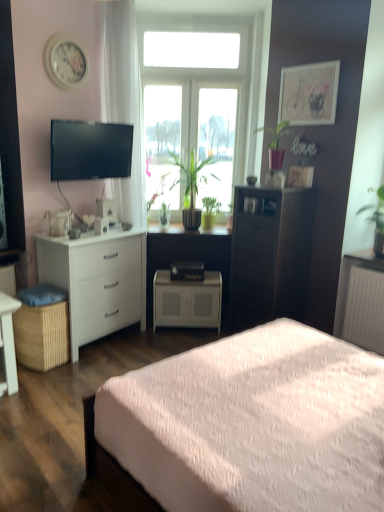
What do you see at coordinates (270, 256) in the screenshot?
I see `dark wood cabinet at center, the 1th chest of drawers in the right-to-left sequence` at bounding box center [270, 256].

The image size is (384, 512). Describe the element at coordinates (365, 309) in the screenshot. I see `white metallic radiator at lower right` at that location.

Describe the element at coordinates (42, 335) in the screenshot. I see `brown woven picnic basket at lower left` at that location.

How much space does white matte cabinet at center, positioned as the second chest of drawers in left-to-right order, occupy vertically?

white matte cabinet at center, positioned as the second chest of drawers in left-to-right order, is 50.84 centimeters tall.

Measure the distance between purple matte plant at upper right, which is the 2th houseplant from right to left, and camera.

purple matte plant at upper right, which is the 2th houseplant from right to left, is 3.59 meters away from camera.

At what (x,y) coordinates should I click in order to perform the action: click on purple matte plant at upper right, which is the 2th houseplant from right to left. Please return your answer as a coordinate pair (x, y). The height and width of the screenshot is (512, 384). Looking at the image, I should click on (276, 145).

The image size is (384, 512). In order to click on dark wood cabinet at center, the 1th chest of drawers in the right-to-left sequence in this screenshot , I will do `click(270, 256)`.

Between point (39, 306) and point (242, 396), which one is positioned in front?

The point (242, 396) is closer to the camera.

Would you consider brown woven picnic basket at lower left to be distant from white quilted bed at center?

Yes, brown woven picnic basket at lower left and white quilted bed at center are located far from each other.

Which of these two, brown woven picnic basket at lower left or white quilted bed at center, is bigger?

Bigger between the two is white quilted bed at center.

How far apart are brown woven picnic basket at lower left and white quilted bed at center?

They are 4.99 feet apart.

Is white glossy clock at upper left to the left or to the right of white matte cabinet at center, which appears as the 2th chest of drawers when viewed from the right, in the image?

white glossy clock at upper left is positioned on white matte cabinet at center, which appears as the 2th chest of drawers when viewed from the right,'s left side.

Who is shorter, white glossy clock at upper left or white matte cabinet at center, positioned as the second chest of drawers in left-to-right order?

With less height is white glossy clock at upper left.

How distant is white glossy clock at upper left from white matte cabinet at center, positioned as the second chest of drawers in left-to-right order?

white glossy clock at upper left and white matte cabinet at center, positioned as the second chest of drawers in left-to-right order, are 1.98 meters apart from each other.

Is white glossy clock at upper left touching white matte cabinet at center, which appears as the 2th chest of drawers when viewed from the right?

No.

From a real-world perspective, between white sheer curtain at upper left and dark wood cabinet at center, the 3th chest of drawers when ordered from left to right, who is vertically higher?

From a 3D spatial view, white sheer curtain at upper left is above.

Looking at their sizes, would you say white sheer curtain at upper left is wider or thinner than dark wood cabinet at center, the 3th chest of drawers when ordered from left to right?

In the image, white sheer curtain at upper left appears to be more narrow than dark wood cabinet at center, the 3th chest of drawers when ordered from left to right.

Is white sheer curtain at upper left positioned with its back to dark wood cabinet at center, the 3th chest of drawers when ordered from left to right?

That's not correct — white sheer curtain at upper left is not looking away from dark wood cabinet at center, the 3th chest of drawers when ordered from left to right.

Is point (127, 111) less distant than point (242, 283)?

No, it is behind (242, 283).

Which point is more forward, (154, 183) or (189, 181)?

Result: The point (189, 181) is closer.

From a real-world perspective, which houseplant is the 1st one underneath the green matte plant at center, marked as the second houseplant in a left-to-right arrangement? Please provide its 2D coordinates.

[(164, 196)]

Based on the photo, from a real-world perspective, who is located lower, green matte plant at center, placed as the fifth houseplant when sorted from right to left, or green matte plant at center, which appears as the fourth houseplant when viewed from the right?

From a 3D spatial view, green matte plant at center, placed as the fifth houseplant when sorted from right to left, is below.

Considering the relative positions of green matte plant at center, placed as the fifth houseplant when sorted from right to left, and green matte plant at center, marked as the second houseplant in a left-to-right arrangement, in the image provided, is green matte plant at center, placed as the fifth houseplant when sorted from right to left, to the left or to the right of green matte plant at center, marked as the second houseplant in a left-to-right arrangement,?

green matte plant at center, placed as the fifth houseplant when sorted from right to left, is to the left of green matte plant at center, marked as the second houseplant in a left-to-right arrangement.

From the image's perspective, which object appears higher, white metallic radiator at lower right or green matte plant at center, arranged as the third houseplant when viewed from the left?

green matte plant at center, arranged as the third houseplant when viewed from the left, appears higher in the image.

Consider the image. From a real-world perspective, is white metallic radiator at lower right above or below green matte plant at center, arranged as the third houseplant when viewed from the left?

In terms of real-world spatial position, white metallic radiator at lower right is below green matte plant at center, arranged as the third houseplant when viewed from the left.

Is green matte plant at center, arranged as the third houseplant when viewed from the left, located within white metallic radiator at lower right?

No, white metallic radiator at lower right does not contain green matte plant at center, arranged as the third houseplant when viewed from the left.

Is white metallic radiator at lower right not close to green matte plant at center, acting as the 3th houseplant starting from the right?

Yes.

Is there a large distance between green glossy plant at upper right, the fifth houseplant viewed from the left, and white matte cabinet at center?

Yes, green glossy plant at upper right, the fifth houseplant viewed from the left, and white matte cabinet at center are quite far apart.

From the image's perspective, is green glossy plant at upper right, the fifth houseplant viewed from the left, on white matte cabinet at center?

Yes.

Who is taller, green glossy plant at upper right, acting as the 1th houseplant starting from the right, or white matte cabinet at center?

With more height is white matte cabinet at center.

Is green glossy plant at upper right, acting as the 1th houseplant starting from the right, facing away from white matte cabinet at center?

green glossy plant at upper right, acting as the 1th houseplant starting from the right, does not have its back to white matte cabinet at center.

Find the location of a particular element. houseplant that is the 3rd object directly below the purple matte plant at upper right, which is the 2th houseplant from right to left (from a real-world perspective) is located at coordinates (376, 219).

Does green glossy plant at upper right, acting as the 1th houseplant starting from the right, touch purple matte plant at upper right, the 4th houseplant viewed from the left?

green glossy plant at upper right, acting as the 1th houseplant starting from the right, is not next to purple matte plant at upper right, the 4th houseplant viewed from the left, and they're not touching.

In terms of size, does green glossy plant at upper right, the fifth houseplant viewed from the left, appear bigger or smaller than purple matte plant at upper right, the 4th houseplant viewed from the left?

Considering their sizes, green glossy plant at upper right, the fifth houseplant viewed from the left, takes up more space than purple matte plant at upper right, the 4th houseplant viewed from the left.

Locate an element on the screen. This screenshot has width=384, height=512. bed in front of the brown woven picnic basket at lower left is located at coordinates (252, 424).

The image size is (384, 512). What are the coordinates of `the chest of drawers that is the 3rd one below the white glossy clock at upper left (from a real-world perspective)` in the screenshot? It's located at (187, 301).

Looking at the image, which one is located further to brown woven picnic basket at lower left, purple matte plant at upper right, which is the 2th houseplant from right to left, or white matte cabinet at center?

purple matte plant at upper right, which is the 2th houseplant from right to left, lies further to brown woven picnic basket at lower left than the other object.

Based on the photo, considering their positions, is white metallic radiator at lower right positioned closer to green glossy plant at upper right, the fifth houseplant viewed from the left, than green matte plant at center, which appears as the fourth houseplant when viewed from the right?

Among the two, white metallic radiator at lower right is located nearer to green glossy plant at upper right, the fifth houseplant viewed from the left.

Estimate the real-world distances between objects in this image. Which object is closer to white metallic radiator at lower right, white glossy coffee cup at left or white matte cabinet at center, which appears as the 2th chest of drawers when viewed from the right?

white matte cabinet at center, which appears as the 2th chest of drawers when viewed from the right.

Which object lies nearer to the anchor point matte white picture frame at upper right, white glossy desk at lower left or purple matte plant at upper right, which is the 2th houseplant from right to left?

Based on the image, purple matte plant at upper right, which is the 2th houseplant from right to left, appears to be nearer to matte white picture frame at upper right.

When comparing their distances from purple matte plant at upper right, the 4th houseplant viewed from the left, does white sheer curtain at upper left or white matte cabinet at center seem closer?

Based on the image, white matte cabinet at center appears to be nearer to purple matte plant at upper right, the 4th houseplant viewed from the left.

When comparing their distances from green matte plant at center, which appears as the fourth houseplant when viewed from the right, does purple matte plant at upper right, the 4th houseplant viewed from the left, or green matte plant at center, placed as the fifth houseplant when sorted from right to left, seem further?

The object further to green matte plant at center, which appears as the fourth houseplant when viewed from the right, is purple matte plant at upper right, the 4th houseplant viewed from the left.

From the picture: When comparing their distances from dark wood cabinet at center, the 3th chest of drawers when ordered from left to right, does white glossy coffee cup at left or white quilted bed at center seem closer?

white quilted bed at center lies closer to dark wood cabinet at center, the 3th chest of drawers when ordered from left to right, than the other object.

Based on their spatial positions, is green matte plant at center, the first houseplant in the left-to-right sequence, or transparent glass window at center closer to white quilted bed at center?

green matte plant at center, the first houseplant in the left-to-right sequence, is positioned closer to the anchor white quilted bed at center.

Locate an element on the screen. This screenshot has width=384, height=512. television between white glossy desk at lower left and purple matte plant at upper right, which is the 2th houseplant from right to left is located at coordinates (90, 150).

Find the location of `desk between white quilted bed at center and dark wood cabinet at center, the 3th chest of drawers when ordered from left to right, along the z-axis`. desk between white quilted bed at center and dark wood cabinet at center, the 3th chest of drawers when ordered from left to right, along the z-axis is located at coordinates (8, 343).

Locate an element on the screen. The width and height of the screenshot is (384, 512). coffee cup that lies between transparent glass window at center and brown woven picnic basket at lower left from top to bottom is located at coordinates (101, 225).

Identify the location of computer desk between white glossy coffee cup at left and white metallic radiator at lower right. (188, 258).